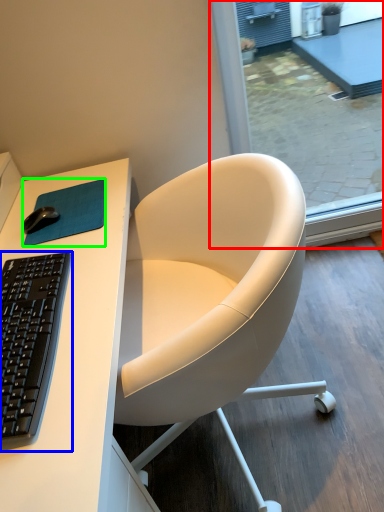
Question: Based on their relative distances, which object is nearer to screen door (highlighted by a red box)? Choose from computer keyboard (highlighted by a blue box) and mousepad (highlighted by a green box).

Choices:
 (A) computer keyboard
 (B) mousepad

Answer: (B)